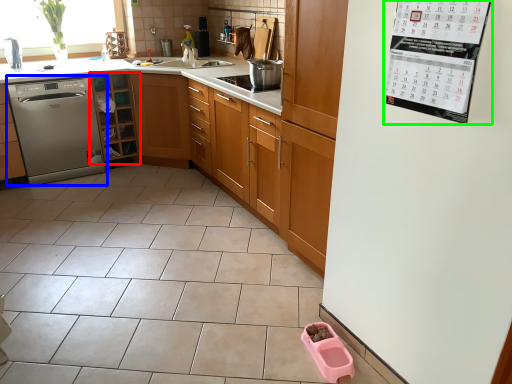
Question: Which object is the closest to the cabinetry (highlighted by a red box)? Choose among these: dishwasher (highlighted by a blue box) or bulletin board (highlighted by a green box).

Choices:
 (A) dishwasher
 (B) bulletin board

Answer: (A)